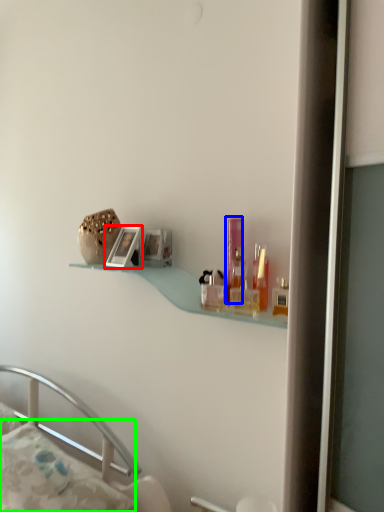
Question: Considering the real-world distances, which object is closest to picture frame (highlighted by a red box)? toiletry (highlighted by a blue box) or pillow (highlighted by a green box).

Choices:
 (A) toiletry
 (B) pillow

Answer: (A)